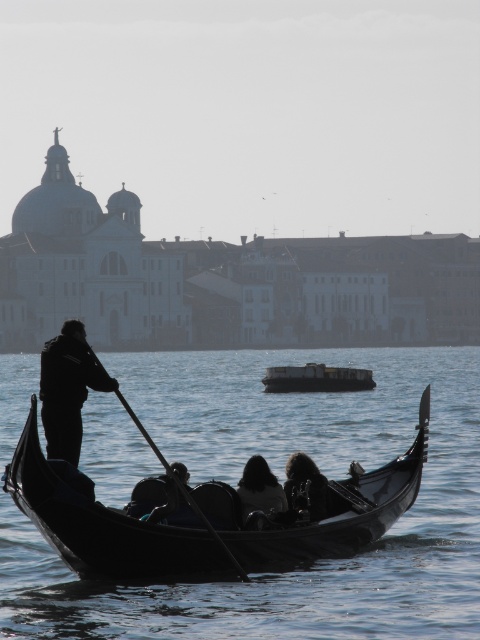
You are a tourist standing on the canal bank and want to take a photo of the gondola. You notice two points marked in the scene. Which point, point (x=52, y=419) or point (x=238, y=570), is closer to you?

Point (x=52, y=419) is closer to you because it is further to the viewer than point (x=238, y=570).

You are standing on the gondola and see two points marked on the water. The first point is at coordinates point [82,397] and the second is at point [276,500]. Which point is closer to you?

Point [82,397] is behind point [276,500], so the second point is closer to you.